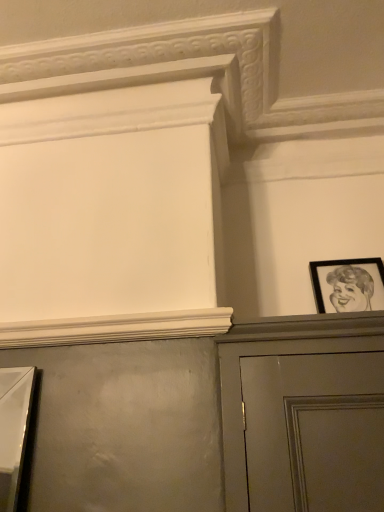
I want to click on black paper at upper right, so click(x=348, y=285).

What do you see at coordinates (348, 285) in the screenshot? This screenshot has width=384, height=512. I see `black paper at upper right` at bounding box center [348, 285].

Image resolution: width=384 pixels, height=512 pixels. I want to click on black paper at upper right, so click(348, 285).